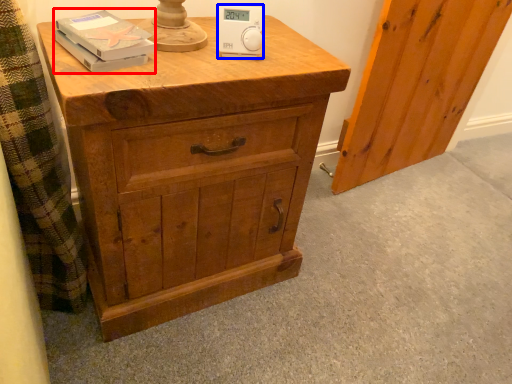
Question: Which of the following is the closest to the observer, book (highlighted by a red box) or ipod (highlighted by a blue box)?

Choices:
 (A) book
 (B) ipod

Answer: (A)